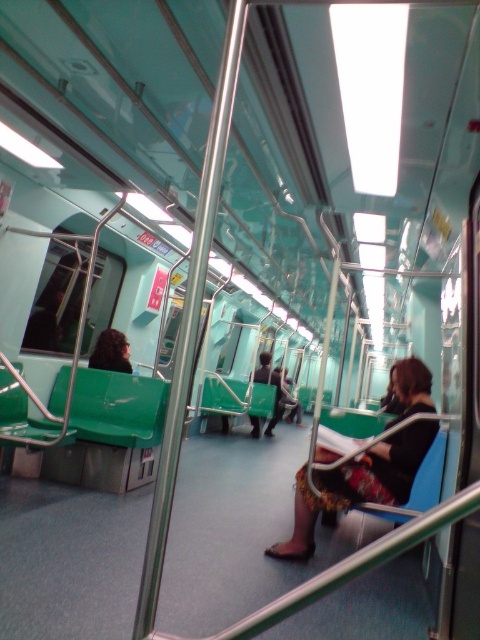
Does point (400, 396) come closer to viewer compared to point (113, 344)?

Yes, point (400, 396) is closer to viewer.

Which is below, black fabric skirt at center or curly brown hair at left?

black fabric skirt at center is lower down.

Is point (420, 438) more distant than point (124, 365)?

That is False.

This screenshot has width=480, height=640. Find the location of `black fabric skirt at center`. black fabric skirt at center is located at coordinates (356, 484).